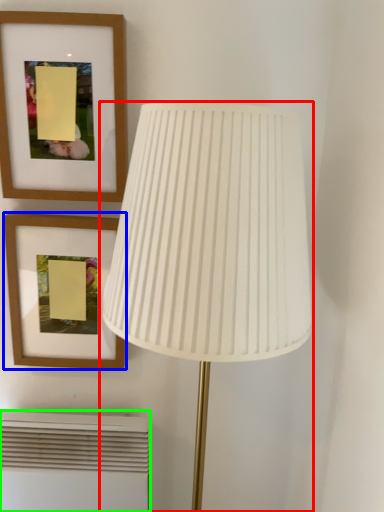
Question: Estimate the real-world distances between objects in this image. Which object is farther from lamp (highlighted by a red box), picture frame (highlighted by a blue box) or air conditioner (highlighted by a green box)?

Choices:
 (A) picture frame
 (B) air conditioner

Answer: (B)